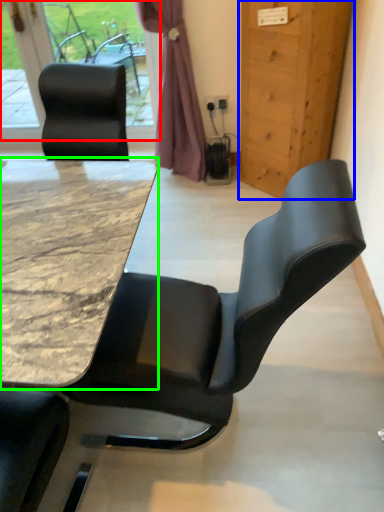
Question: Estimate the real-world distances between objects in this image. Which object is closer to window (highlighted by a red box), door (highlighted by a blue box) or table (highlighted by a green box)?

Choices:
 (A) door
 (B) table

Answer: (A)